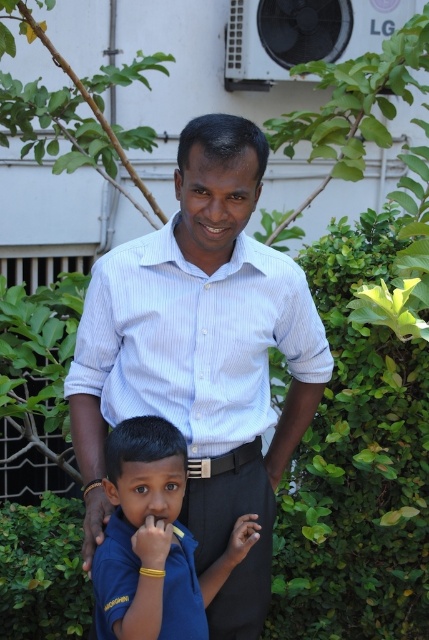
You are a photographer trying to capture a candid shot of the two people in the scene. You notice the blue fabric shirt at lower center and the smooth skin hand at lower center. Which object should you focus on to ensure it appears larger in your photo?

The blue fabric shirt at lower center is taller than the smooth skin hand at lower center, so focusing on the blue fabric shirt at lower center will make it appear larger in the photo.